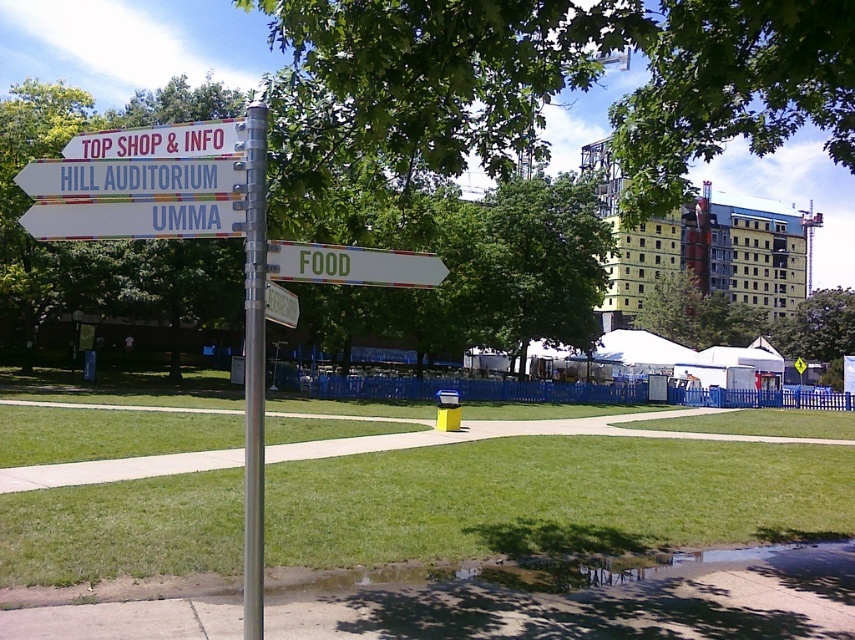
Is green leafy tree at center below metallic silver sign at center?

Actually, green leafy tree at center is above metallic silver sign at center.

Between point (528, 300) and point (270, 304), which one is positioned in front?

Point (270, 304) is in front.

Where is `green leafy tree at center`? The image size is (855, 640). green leafy tree at center is located at coordinates (547, 260).

Does white plastic sign at center have a lesser height compared to white plastic sign at upper center?

Indeed, white plastic sign at center has a lesser height compared to white plastic sign at upper center.

You are a GUI agent. You are given a task and a screenshot of the screen. Output one action in this format:
    pyautogui.click(x=<x>, y=<y>)
    Task: Click on the white plastic sign at center
    
    Given the screenshot: What is the action you would take?
    click(x=134, y=220)

From the picture: Between white plastic sign at upper left and metallic silver sign at center, which one has less height?

metallic silver sign at center

Can you confirm if white plastic sign at upper left is positioned above metallic silver sign at center?

Correct, white plastic sign at upper left is located above metallic silver sign at center.

Describe the element at coordinates (128, 177) in the screenshot. I see `white plastic sign at upper left` at that location.

This screenshot has height=640, width=855. Identify the location of white plastic sign at upper left. (128, 177).